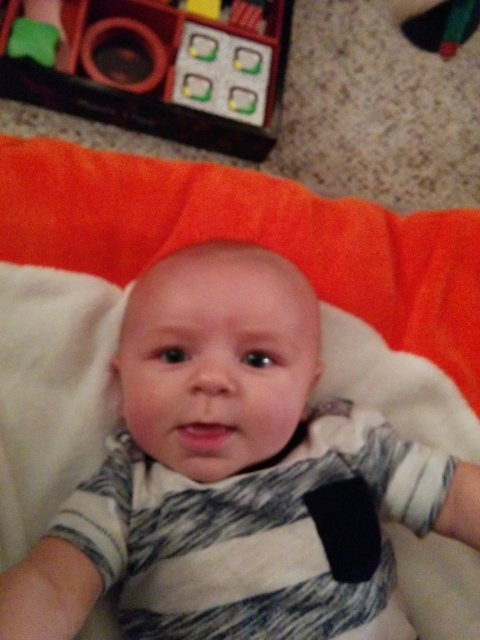
Who is more forward, (305, 321) or (199, 29)?

Point (305, 321) is in front.

Can you confirm if white soft baby at center is taller than matte plastic toy at upper left?

Yes, white soft baby at center is taller than matte plastic toy at upper left.

The width and height of the screenshot is (480, 640). What do you see at coordinates (235, 476) in the screenshot?
I see `white soft baby at center` at bounding box center [235, 476].

At what (x,y) coordinates should I click in order to perform the action: click on white soft baby at center. Please return your answer as a coordinate pair (x, y). Looking at the image, I should click on (235, 476).